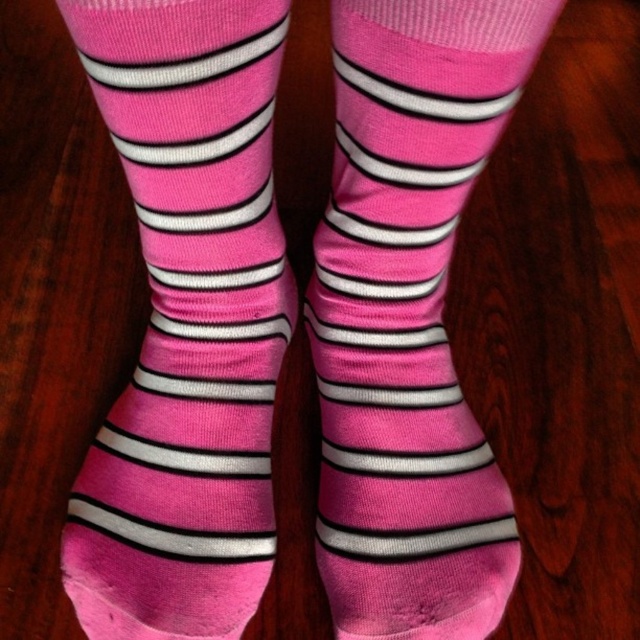
Question: Can you confirm if pink soft cotton sock at center is positioned to the right of pink cotton socks at center?

Choices:
 (A) yes
 (B) no

Answer: (B)

Question: Which object appears farthest from the camera in this image?

Choices:
 (A) pink soft cotton sock at center
 (B) pink cotton socks at center

Answer: (B)

Question: Where is pink soft cotton sock at center located in relation to pink cotton socks at center in the image?

Choices:
 (A) right
 (B) left

Answer: (B)

Question: Among these objects, which one is farthest from the camera?

Choices:
 (A) pink soft cotton sock at center
 (B) pink cotton socks at center

Answer: (B)

Question: Does pink soft cotton sock at center have a lesser width compared to pink cotton socks at center?

Choices:
 (A) yes
 (B) no

Answer: (B)